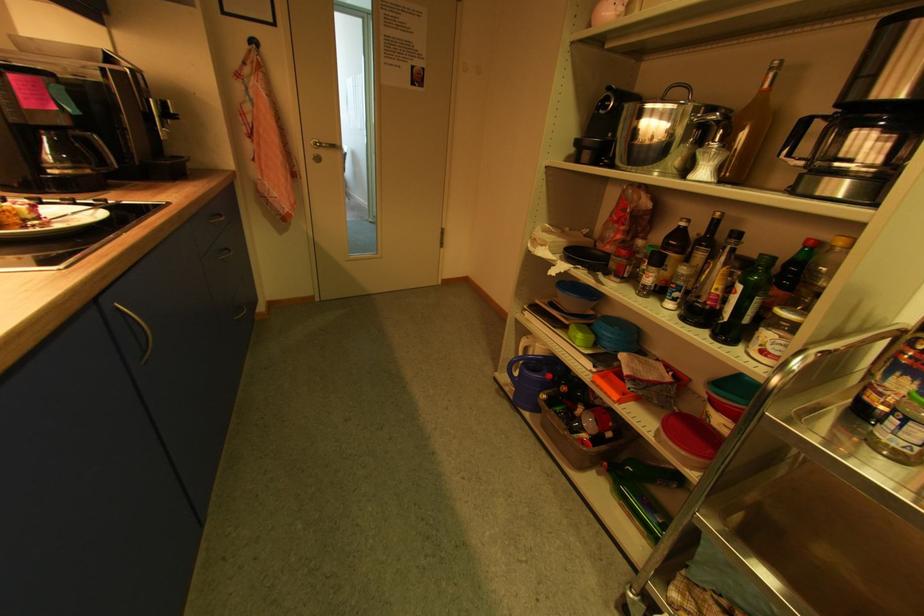
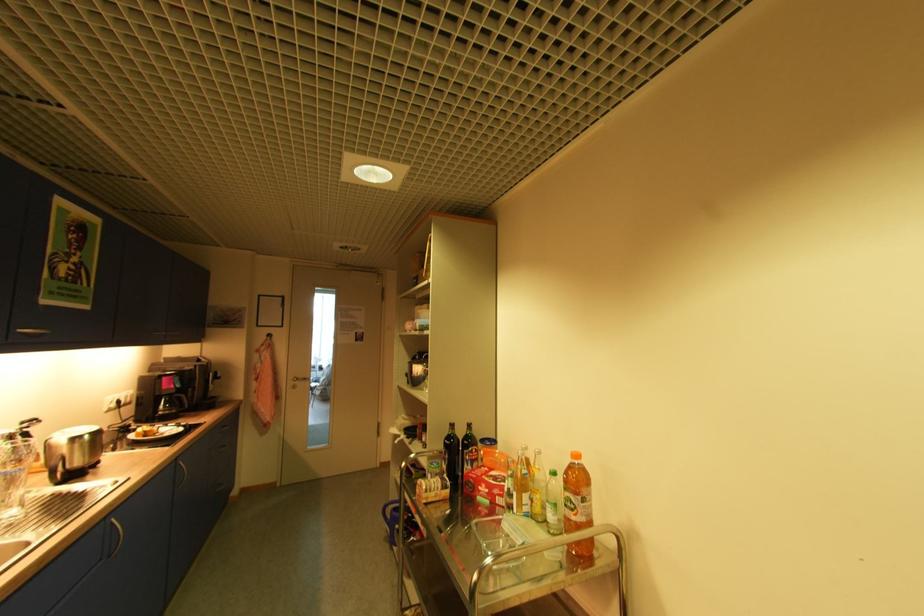
Question: I am providing you with two images of the same scene from different viewpoints. After the viewpoint changes to image2, which objects are now occluded?

Choices:
 (A) clear glass bottle
 (B) green glass bottle
 (C) red cardboard box
 (D) none of these

Answer: (D)